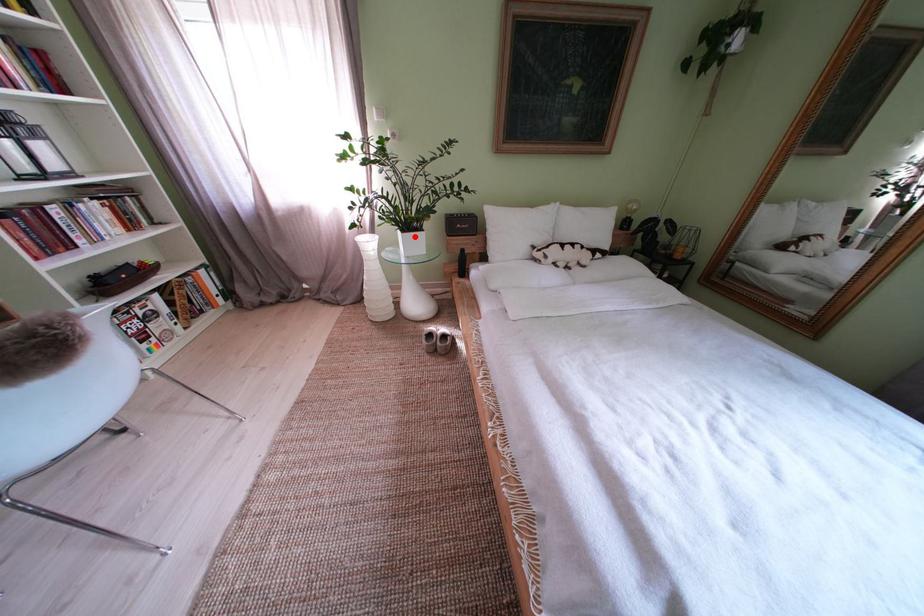
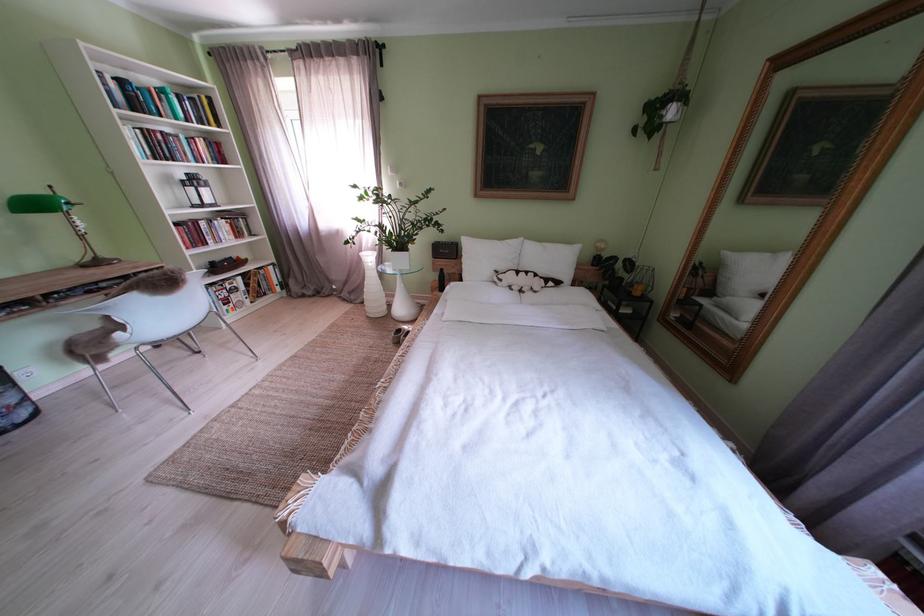
In the second image, find the point that corresponds to the highlighted location in the first image.

(405, 256)